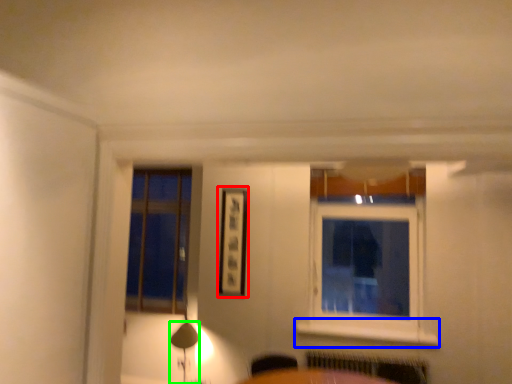
Question: Based on their relative distances, which object is nearer to picture frame (highlighted by a red box)? Choose from window sill (highlighted by a blue box) and table lamp (highlighted by a green box).

Choices:
 (A) window sill
 (B) table lamp

Answer: (B)